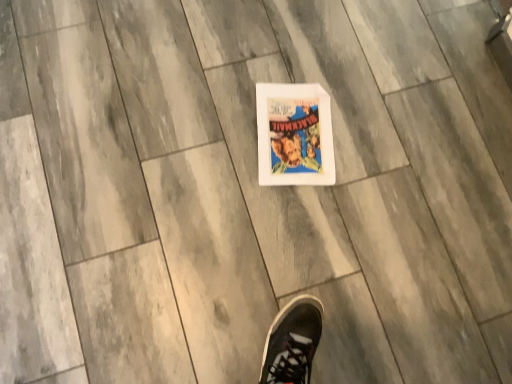
Find the location of a particular element. Image resolution: width=512 pixels, height=384 pixels. vacant space underneath matte paper comic book at center (from a real-world perspective) is located at coordinates (306, 128).